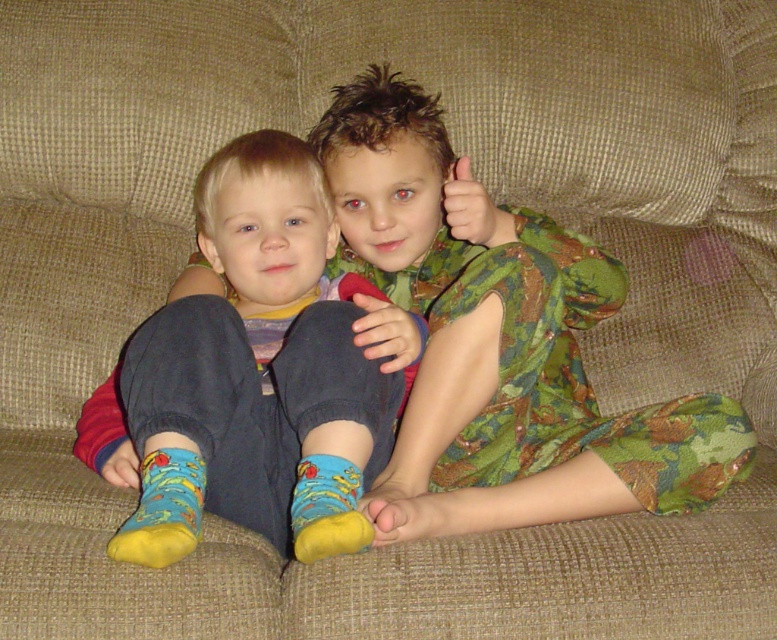
Question: Among these points, which one is nearest to the camera?

Choices:
 (A) (145, 504)
 (B) (368, 538)
 (C) (385, 157)
 (D) (96, 412)

Answer: (B)

Question: Does blue fabric sock at lower left appear on the left side of yellow fabric sock at lower center?

Choices:
 (A) yes
 (B) no

Answer: (A)

Question: Is camouflage-patterned pajamas at center above yellow fabric sock at lower center?

Choices:
 (A) no
 (B) yes

Answer: (B)

Question: Estimate the real-world distances between objects in this image. Which object is farther from the yellow fabric sock at lower center?

Choices:
 (A) camouflage-patterned pajamas at center
 (B) blue cotton socks at center
 (C) blue fabric sock at lower left

Answer: (A)

Question: Is camouflage-patterned pajamas at center thinner than yellow fabric sock at lower center?

Choices:
 (A) no
 (B) yes

Answer: (A)

Question: Which of these objects is positioned closest to the blue cotton socks at center?

Choices:
 (A) blue fabric sock at lower left
 (B) camouflage-patterned pajamas at center

Answer: (B)